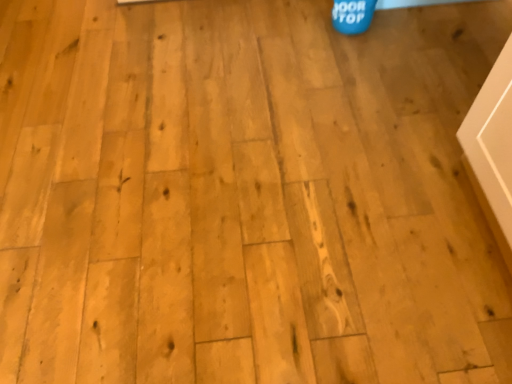
You are a GUI agent. You are given a task and a screenshot of the screen. Output one action in this format:
    pyautogui.click(x=<x>, y=<y>)
    Task: Click on the unoccupied region to the right of blue rubber door stop at upper right
    This screenshot has width=512, height=384.
    Given the screenshot: What is the action you would take?
    pyautogui.click(x=394, y=26)